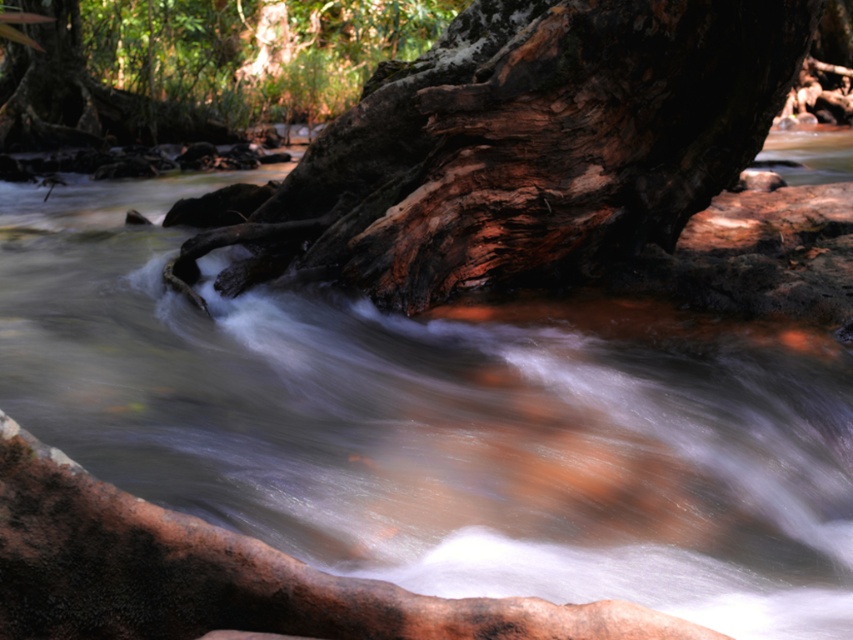
Question: Is rough bark tree trunk at center above smooth bark tree at upper left?

Choices:
 (A) yes
 (B) no

Answer: (B)

Question: Which object is farther from the camera taking this photo?

Choices:
 (A) rough bark tree trunk at center
 (B) smooth bark tree at upper left

Answer: (B)

Question: Is rough bark tree trunk at center bigger than smooth bark tree at upper left?

Choices:
 (A) yes
 (B) no

Answer: (B)

Question: Which object is closer to the camera taking this photo?

Choices:
 (A) smooth bark tree at upper left
 (B) rough bark tree trunk at center

Answer: (B)

Question: Which point is closer to the camera?

Choices:
 (A) rough bark tree trunk at center
 (B) smooth bark tree at upper left

Answer: (A)

Question: Can you confirm if rough bark tree trunk at center is smaller than smooth bark tree at upper left?

Choices:
 (A) no
 (B) yes

Answer: (B)